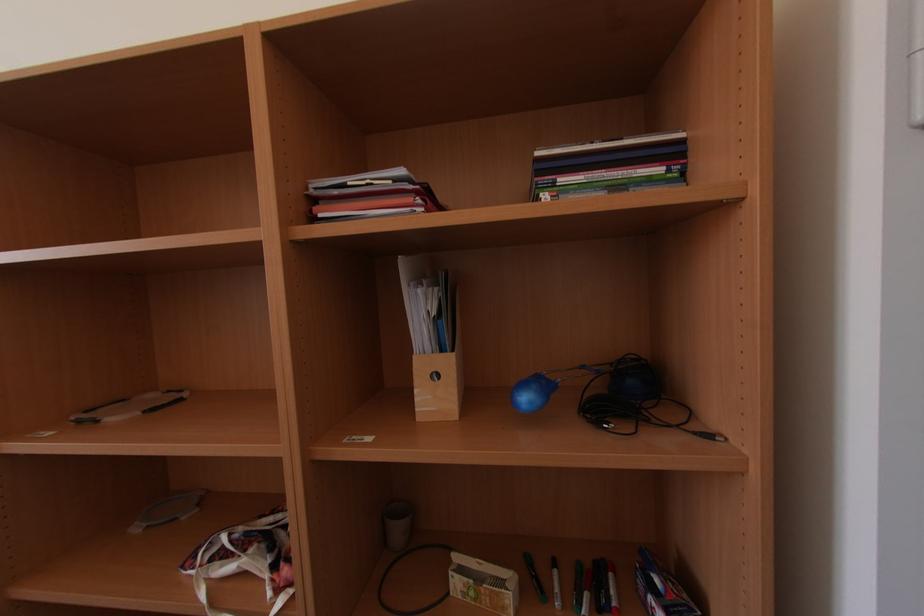
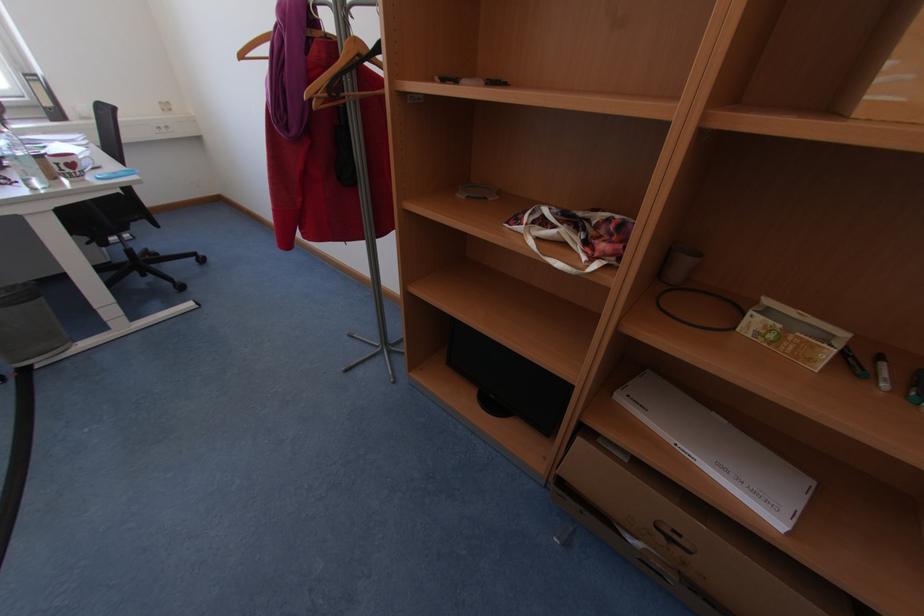
The first image is from the beginning of the video and the second image is from the end. How did the camera likely rotate when shooting the video?

The camera rotated toward left-down.